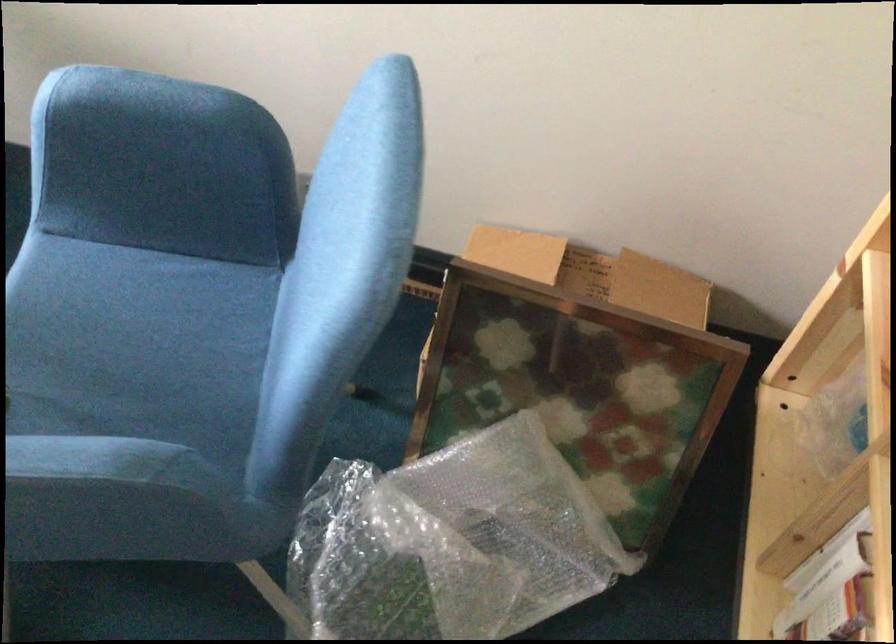
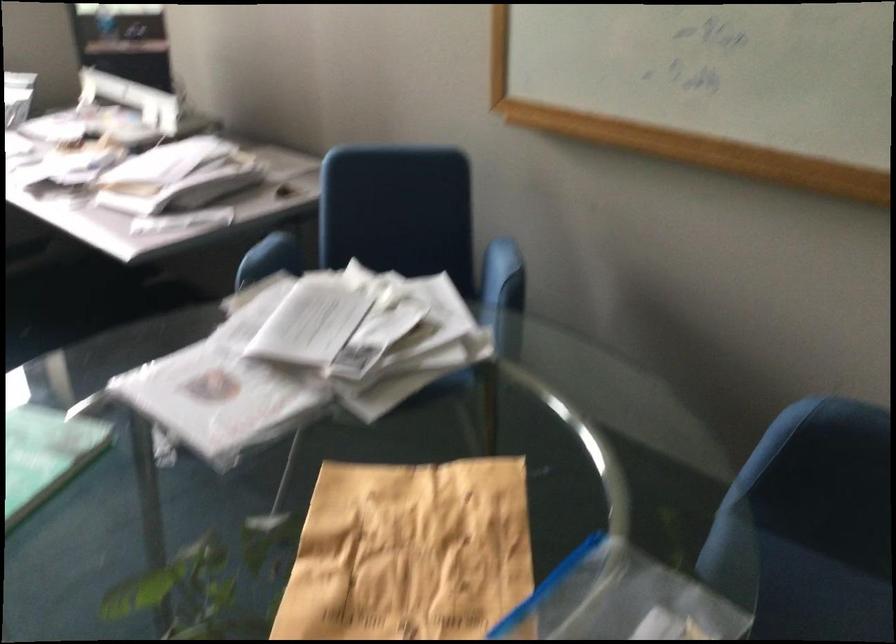
The first image is from the beginning of the video and the second image is from the end. How did the camera likely rotate when shooting the video?

The camera rotated toward left-up.